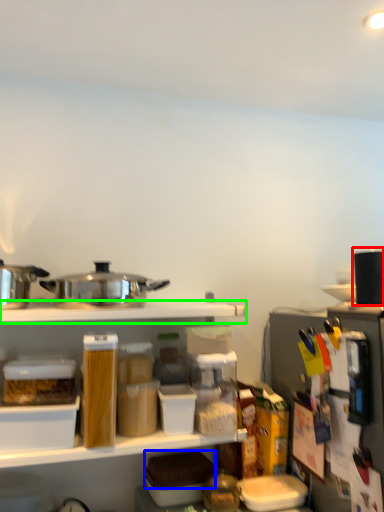
Question: Estimate the real-world distances between objects in this image. Which object is closer to appliance (highlighted by a red box), food (highlighted by a blue box) or shelf (highlighted by a green box)?

Choices:
 (A) food
 (B) shelf

Answer: (B)